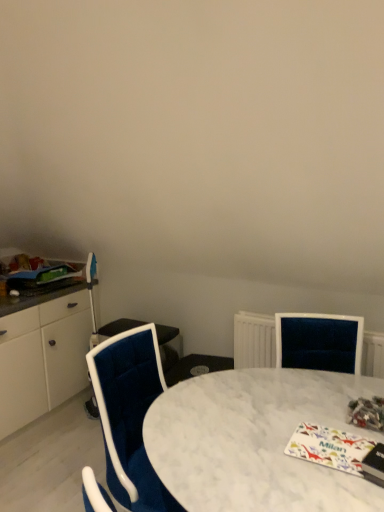
You are a GUI agent. You are given a task and a screenshot of the screen. Output one action in this format:
    pyautogui.click(x=<x>, y=<y>)
    Task: Click on the vacant space that is to the left of white glossy magazine at lower right, which is the third magazine from top to bottom
    The height and width of the screenshot is (512, 384).
    Given the screenshot: What is the action you would take?
    pyautogui.click(x=260, y=448)